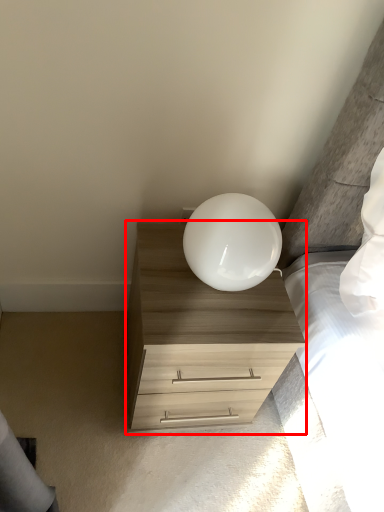
Question: Where is chest of drawers (annotated by the red box) located in relation to lamp in the image?

Choices:
 (A) left
 (B) right

Answer: (A)